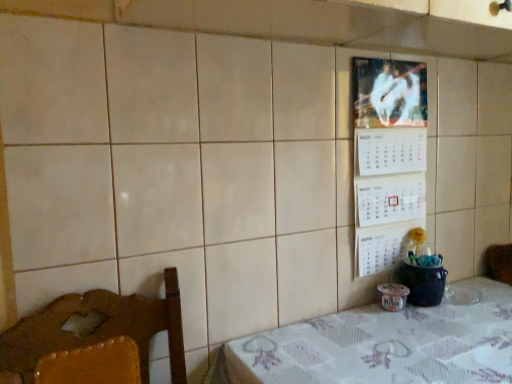
Where is `white fabric table at lower right`? white fabric table at lower right is located at coordinates (388, 344).

What do you see at coordinates (388, 344) in the screenshot? This screenshot has width=512, height=384. I see `white fabric table at lower right` at bounding box center [388, 344].

Where is `white paper calendar at upper right`? white paper calendar at upper right is located at coordinates (387, 157).

The image size is (512, 384). What do you see at coordinates (387, 157) in the screenshot?
I see `white paper calendar at upper right` at bounding box center [387, 157].

Measure the distance between point (371, 125) and camera.

Point (371, 125) is 4.03 feet away from camera.

At what (x,y) coordinates should I click in order to perform the action: click on white fabric table at lower right. Please return your answer as a coordinate pair (x, y). The height and width of the screenshot is (384, 512). Looking at the image, I should click on (388, 344).

Considering the positions of objects white fabric table at lower right and white paper calendar at upper right in the image provided, who is more to the right, white fabric table at lower right or white paper calendar at upper right?

white fabric table at lower right.

Is the depth of white fabric table at lower right less than that of white paper calendar at upper right?

That is True.

Considering the points (354, 336) and (383, 85), which point is in front, point (354, 336) or point (383, 85)?

The point (354, 336) is in front.

From the image's perspective, between white fabric table at lower right and white paper calendar at upper right, who is located below?

white fabric table at lower right is shown below in the image.

From a real-world perspective, between white fabric table at lower right and white paper calendar at upper right, who is vertically lower?

white fabric table at lower right, from a real-world perspective.

In terms of width, does white fabric table at lower right look wider or thinner when compared to white paper calendar at upper right?

In the image, white fabric table at lower right appears to be wider than white paper calendar at upper right.

Which of these two, white fabric table at lower right or white paper calendar at upper right, stands taller?

With more height is white paper calendar at upper right.

Between white fabric table at lower right and white paper calendar at upper right, which one has smaller size?

Smaller between the two is white paper calendar at upper right.

Would you say white fabric table at lower right is inside or outside white paper calendar at upper right?

white fabric table at lower right is located beyond the bounds of white paper calendar at upper right.

From the picture: Can you see white fabric table at lower right touching white paper calendar at upper right?

No, white fabric table at lower right is not touching white paper calendar at upper right.

Is white fabric table at lower right facing towards white paper calendar at upper right?

No, white fabric table at lower right is not turned towards white paper calendar at upper right.

Locate an element on the screen. table beneath the white paper calendar at upper right (from a real-world perspective) is located at coordinates (388, 344).

Which object is positioned more to the right, white paper calendar at upper right or white fabric table at lower right?

white fabric table at lower right is more to the right.

Which is behind, white paper calendar at upper right or white fabric table at lower right?

white paper calendar at upper right is more distant.

Between point (380, 254) and point (226, 366), which one is positioned behind?

The point (380, 254) is more distant.

From the image's perspective, which one is positioned higher, white paper calendar at upper right or white fabric table at lower right?

white paper calendar at upper right, from the image's perspective.

From a real-world perspective, who is located lower, white paper calendar at upper right or white fabric table at lower right?

white fabric table at lower right.

Which object is thinner, white paper calendar at upper right or white fabric table at lower right?

Thinner between the two is white paper calendar at upper right.

Considering the relative sizes of white paper calendar at upper right and white fabric table at lower right in the image provided, is white paper calendar at upper right shorter than white fabric table at lower right?

No, white paper calendar at upper right is not shorter than white fabric table at lower right.

Can you confirm if white paper calendar at upper right is bigger than white fabric table at lower right?

No, white paper calendar at upper right is not bigger than white fabric table at lower right.

Choose the correct answer: Is white paper calendar at upper right inside white fabric table at lower right or outside it?

white paper calendar at upper right is spatially situated outside white fabric table at lower right.

Is white paper calendar at upper right directly adjacent to white fabric table at lower right?

white paper calendar at upper right and white fabric table at lower right are clearly separated.

In the scene shown: Is white fabric table at lower right at the back of white paper calendar at upper right?

No, white paper calendar at upper right's orientation is not away from white fabric table at lower right.

I want to click on bulletin board located above the white fabric table at lower right (from the image's perspective), so click(387, 157).

The height and width of the screenshot is (384, 512). Identify the location of table that appears below the white paper calendar at upper right (from a real-world perspective). (388, 344).

At what (x,y) coordinates should I click in order to perform the action: click on bulletin board above the white fabric table at lower right (from a real-world perspective). Please return your answer as a coordinate pair (x, y). Looking at the image, I should click on (387, 157).